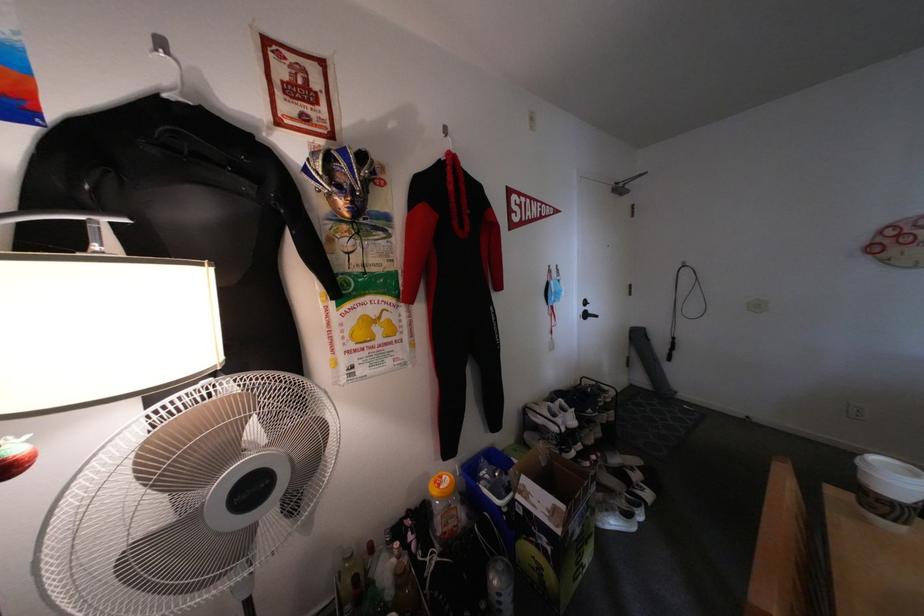
The height and width of the screenshot is (616, 924). What are the coordinates of `rolled yoga mat` in the screenshot? It's located at (653, 422).